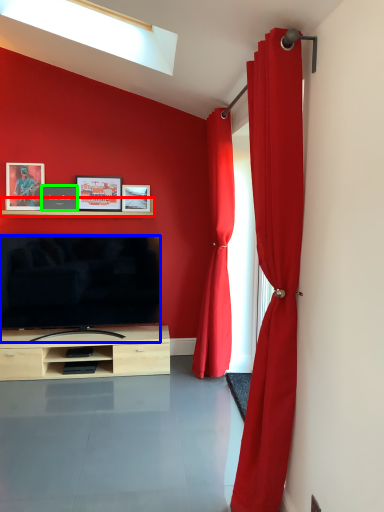
Question: Based on their relative distances, which object is nearer to shelf (highlighted by a red box)? Choose from television (highlighted by a blue box) and picture frame (highlighted by a green box).

Choices:
 (A) television
 (B) picture frame

Answer: (B)